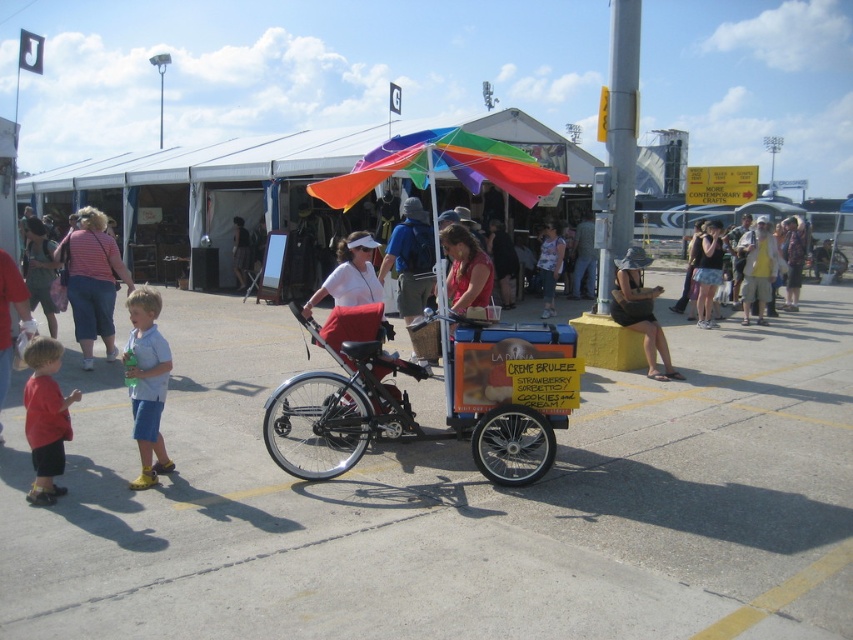
Looking at this image, does light blue denim shorts at lower left appear under matte red shorts at lower left?

No.

Can you confirm if light blue denim shorts at lower left is positioned to the right of matte red shorts at lower left?

Yes, light blue denim shorts at lower left is to the right of matte red shorts at lower left.

Between point (143, 465) and point (32, 385), which one is positioned in front?

Point (32, 385)

You are a GUI agent. You are given a task and a screenshot of the screen. Output one action in this format:
    pyautogui.click(x=<x>, y=<y>)
    Task: Click on the light blue denim shorts at lower left
    The width and height of the screenshot is (853, 640).
    Given the screenshot: What is the action you would take?
    pyautogui.click(x=146, y=381)

Is point (380, 349) in front of point (635, 276)?

Yes, point (380, 349) is in front of point (635, 276).

Find the location of `metallic silver cart at center`. metallic silver cart at center is located at coordinates (387, 410).

Between point (386, 332) and point (631, 268), which one is positioned behind?

The point (631, 268) is behind.

The width and height of the screenshot is (853, 640). I want to click on metallic silver cart at center, so click(387, 410).

Between point (157, 458) and point (636, 296), which one is positioned behind?

The point (636, 296) is behind.

Can you confirm if light blue denim shorts at lower left is smaller than black fabric hat at center?

Yes, light blue denim shorts at lower left is smaller than black fabric hat at center.

Is point (140, 412) less distant than point (648, 376)?

Yes.

Where is `light blue denim shorts at lower left`? The image size is (853, 640). light blue denim shorts at lower left is located at coordinates (146, 381).